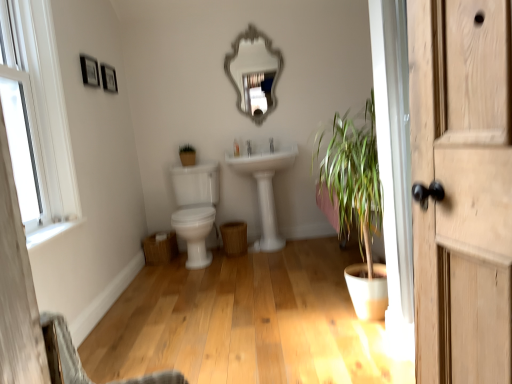
Measure the distance between white glossy faucet at center and camera.

white glossy faucet at center is 3.87 meters away from camera.

The image size is (512, 384). I want to click on white glossy faucet at center, so click(271, 145).

What is the approximate height of white wooden window at upper left?

It is 4.22 feet.

You are a GUI agent. You are given a task and a screenshot of the screen. Output one action in this format:
    pyautogui.click(x=<x>, y=<y>)
    Task: Click on the white glossy sink at center
    The image size is (512, 384).
    Given the screenshot: What is the action you would take?
    pyautogui.click(x=265, y=188)

From the image's perspective, is white glossy sink at center above or below matte black picture frame at upper left, which is the 2th picture frame in front-to-back order?

white glossy sink at center is below matte black picture frame at upper left, which is the 2th picture frame in front-to-back order.

Is white glossy sink at center further to the viewer compared to matte black picture frame at upper left, which appears as the first picture frame when viewed from the back?

Yes, it is.

From the image's perspective, count 2nd picture frames upward from the white glossy sink at center and point to it. Please provide its 2D coordinates.

[(109, 78)]

From a real-world perspective, is white glossy sink at center positioned above or below matte black picture frame at upper left, which appears as the first picture frame when viewed from the back?

white glossy sink at center is situated lower than matte black picture frame at upper left, which appears as the first picture frame when viewed from the back, in the real world.

Is point (269, 142) farther from viewer compared to point (264, 91)?

That is True.

Considering the sizes of objects white glossy faucet at center and silver metallic mirror at upper center in the image provided, who is smaller, white glossy faucet at center or silver metallic mirror at upper center?

white glossy faucet at center is smaller.

From the image's perspective, is white glossy faucet at center over silver metallic mirror at upper center?

No, from the image's perspective, white glossy faucet at center is not over silver metallic mirror at upper center.

Identify the location of sink that is below the matte black picture frame at upper left, which appears as the first picture frame when viewed from the back (from the image's perspective). This screenshot has width=512, height=384. (265, 188).

Looking at this image, which object is wider, matte black picture frame at upper left, which is the 2th picture frame in front-to-back order, or white glossy sink at center?

With larger width is white glossy sink at center.

Is there a large distance between matte black picture frame at upper left, which is the 2th picture frame in front-to-back order, and white glossy sink at center?

Yes, matte black picture frame at upper left, which is the 2th picture frame in front-to-back order, and white glossy sink at center are located far from each other.

Is white glossy faucet at center wider or thinner than white glossy sink at center?

Clearly, white glossy faucet at center has less width compared to white glossy sink at center.

Is white glossy faucet at center turned away from white glossy sink at center?

white glossy faucet at center does not have its back to white glossy sink at center.

Which is more to the left, white glossy faucet at center or white glossy sink at center?

From the viewer's perspective, white glossy sink at center appears more on the left side.

Looking at this image, from the image's perspective, is white glossy faucet at center on white glossy sink at center?

Indeed, from the image's perspective, white glossy faucet at center is shown above white glossy sink at center.

Looking at this image, is silver metallic mirror at upper center smaller than white glossy faucet at center?

Actually, silver metallic mirror at upper center might be larger than white glossy faucet at center.

Is silver metallic mirror at upper center thinner than white glossy faucet at center?

Yes.

Where is `mirror behind the white glossy faucet at center`? The image size is (512, 384). mirror behind the white glossy faucet at center is located at coordinates (254, 74).

Would you say silver metallic mirror at upper center is outside white glossy faucet at center?

silver metallic mirror at upper center is positioned outside white glossy faucet at center.

From the image's perspective, which one is positioned lower, white glossy sink at center or wooden picture frame at upper left, the 1th picture frame from the front?

white glossy sink at center appears lower in the image.

From a real-world perspective, between white glossy sink at center and wooden picture frame at upper left, arranged as the 2th picture frame when viewed from the back, who is vertically higher?

wooden picture frame at upper left, arranged as the 2th picture frame when viewed from the back.

Between white glossy sink at center and wooden picture frame at upper left, the 1th picture frame from the front, which one has more height?

white glossy sink at center is taller.

At what (x,y) coordinates should I click in order to perform the action: click on sink below the silver metallic mirror at upper center (from the image's perspective). Please return your answer as a coordinate pair (x, y). This screenshot has height=384, width=512. Looking at the image, I should click on (265, 188).

Considering the relative sizes of white glossy sink at center and silver metallic mirror at upper center in the image provided, is white glossy sink at center shorter than silver metallic mirror at upper center?

No.

From a real-world perspective, which is physically above, white glossy sink at center or silver metallic mirror at upper center?

In real-world perspective, silver metallic mirror at upper center is above.

Is white glossy sink at center positioned behind silver metallic mirror at upper center?

No.

At what (x,y) coordinates should I click in order to perform the action: click on picture frame that is the 2nd one above the white glossy sink at center (from a real-world perspective). Please return your answer as a coordinate pair (x, y). The width and height of the screenshot is (512, 384). Looking at the image, I should click on (109, 78).

This screenshot has height=384, width=512. What are the coordinates of `faucet below the silver metallic mirror at upper center (from the image's perspective)` in the screenshot? It's located at (271, 145).

When comparing their distances from white glossy sink at center, does wooden picture frame at upper left, the 1th picture frame from the front, or silver metallic mirror at upper center seem further?

wooden picture frame at upper left, the 1th picture frame from the front, is positioned further to the anchor white glossy sink at center.

Looking at the image, which one is located closer to white glossy faucet at center, wooden picture frame at upper left, the 1th picture frame from the front, or white wooden window at upper left?

Among the two, wooden picture frame at upper left, the 1th picture frame from the front, is located nearer to white glossy faucet at center.

Which object lies nearer to the anchor point white glossy faucet at center, white wooden window at upper left or matte black picture frame at upper left, which appears as the first picture frame when viewed from the back?

Among the two, matte black picture frame at upper left, which appears as the first picture frame when viewed from the back, is located nearer to white glossy faucet at center.

Which object lies further to the anchor point matte black picture frame at upper left, which is the 2th picture frame in front-to-back order, silver metallic mirror at upper center or white wooden window at upper left?

silver metallic mirror at upper center is positioned further to the anchor matte black picture frame at upper left, which is the 2th picture frame in front-to-back order.

Considering their positions, is white glossy faucet at center positioned further to matte black picture frame at upper left, which is the 2th picture frame in front-to-back order, than white glossy sink at center?

white glossy sink at center.

Looking at the image, which one is located further to white glossy sink at center, silver metallic mirror at upper center or matte black picture frame at upper left, which appears as the first picture frame when viewed from the back?

The object further to white glossy sink at center is matte black picture frame at upper left, which appears as the first picture frame when viewed from the back.

Looking at the image, which one is located further to wooden picture frame at upper left, the 1th picture frame from the front, silver metallic mirror at upper center or white wooden window at upper left?

silver metallic mirror at upper center is further to wooden picture frame at upper left, the 1th picture frame from the front.

Estimate the real-world distances between objects in this image. Which object is further from white glossy faucet at center, matte black picture frame at upper left, which appears as the first picture frame when viewed from the back, or white glossy sink at center?

matte black picture frame at upper left, which appears as the first picture frame when viewed from the back, is positioned further to the anchor white glossy faucet at center.

At what (x,y) coordinates should I click in order to perform the action: click on sink positioned between white wooden window at upper left and silver metallic mirror at upper center from near to far. Please return your answer as a coordinate pair (x, y). Looking at the image, I should click on (265, 188).

You are a GUI agent. You are given a task and a screenshot of the screen. Output one action in this format:
    pyautogui.click(x=<x>, y=<y>)
    Task: Click on the picture frame between matte black picture frame at upper left, which appears as the first picture frame when viewed from the back, and white glossy faucet at center, in the horizontal direction
    This screenshot has width=512, height=384.
    Given the screenshot: What is the action you would take?
    pyautogui.click(x=89, y=70)

The image size is (512, 384). In order to click on faucet located between white wooden window at upper left and silver metallic mirror at upper center in the depth direction in this screenshot , I will do `click(271, 145)`.

The width and height of the screenshot is (512, 384). I want to click on sink between wooden picture frame at upper left, arranged as the 2th picture frame when viewed from the back, and white glossy faucet at center, so click(265, 188).